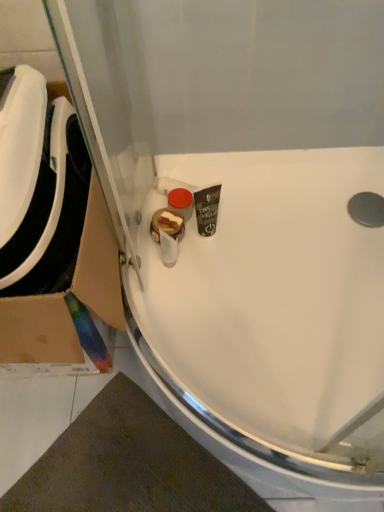
Question: Is cardboard at left at the right side of white glossy sink at center, marked as the 2th sink in a left-to-right arrangement?

Choices:
 (A) yes
 (B) no

Answer: (B)

Question: Is cardboard at left positioned beyond the bounds of white glossy sink at center, marked as the 2th sink in a left-to-right arrangement?

Choices:
 (A) no
 (B) yes

Answer: (B)

Question: From the image's perspective, is cardboard at left located beneath white glossy sink at center, acting as the first sink starting from the right?

Choices:
 (A) yes
 (B) no

Answer: (B)

Question: Is cardboard at left oriented towards white glossy sink at center, acting as the first sink starting from the right?

Choices:
 (A) yes
 (B) no

Answer: (B)

Question: Considering the relative sizes of cardboard at left and white glossy sink at center, acting as the first sink starting from the right, in the image provided, is cardboard at left thinner than white glossy sink at center, acting as the first sink starting from the right,?

Choices:
 (A) yes
 (B) no

Answer: (A)

Question: Relative to white glossy sink at left, arranged as the 1th sink when viewed from the left, is cardboard at left in front or behind?

Choices:
 (A) behind
 (B) front

Answer: (A)

Question: In terms of height, does cardboard at left look taller or shorter compared to white glossy sink at left, which ranks as the 2th sink in right-to-left order?

Choices:
 (A) tall
 (B) short

Answer: (A)

Question: Considering the positions of cardboard at left and white glossy sink at left, arranged as the 1th sink when viewed from the left, in the image, is cardboard at left wider or thinner than white glossy sink at left, arranged as the 1th sink when viewed from the left,?

Choices:
 (A) thin
 (B) wide

Answer: (B)

Question: From a real-world perspective, is cardboard at left physically located above or below white glossy sink at left, arranged as the 1th sink when viewed from the left?

Choices:
 (A) above
 (B) below

Answer: (B)

Question: Is white glossy sink at left, arranged as the 1th sink when viewed from the left, to the left or to the right of white glossy sink at center, marked as the 2th sink in a left-to-right arrangement, in the image?

Choices:
 (A) left
 (B) right

Answer: (A)

Question: Looking at the image, does white glossy sink at left, which ranks as the 2th sink in right-to-left order, seem bigger or smaller compared to white glossy sink at center, marked as the 2th sink in a left-to-right arrangement?

Choices:
 (A) big
 (B) small

Answer: (B)

Question: Relative to white glossy sink at center, acting as the first sink starting from the right, is white glossy sink at left, arranged as the 1th sink when viewed from the left, in front or behind?

Choices:
 (A) behind
 (B) front

Answer: (B)

Question: Is white glossy sink at left, which ranks as the 2th sink in right-to-left order, taller or shorter than white glossy sink at center, marked as the 2th sink in a left-to-right arrangement?

Choices:
 (A) short
 (B) tall

Answer: (B)

Question: Do you think white glossy sink at center, marked as the 2th sink in a left-to-right arrangement, is within cardboard at left, or outside of it?

Choices:
 (A) outside
 (B) inside

Answer: (A)

Question: In the image, is white glossy sink at center, acting as the first sink starting from the right, positioned in front of or behind cardboard at left?

Choices:
 (A) front
 (B) behind

Answer: (B)